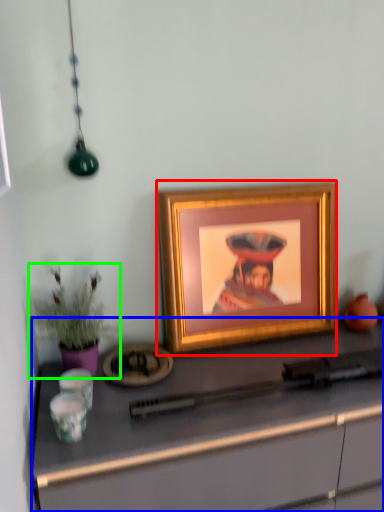
Question: Which is farther away from picture frame (highlighted by a red box)? desk (highlighted by a blue box) or houseplant (highlighted by a green box)?

Choices:
 (A) desk
 (B) houseplant

Answer: (B)